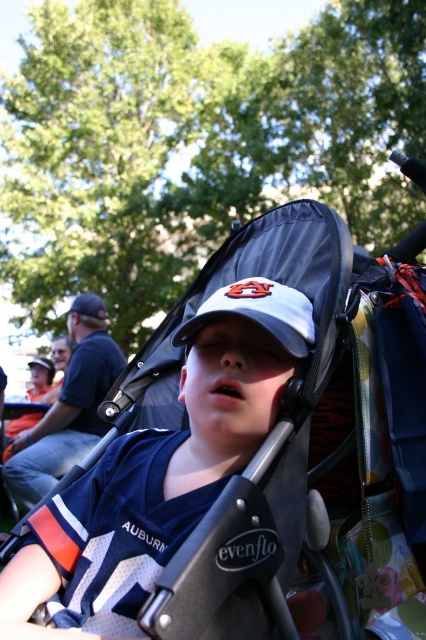
You are a photographer taking a picture of the stroller and its contents. You notice a point at coordinates (158,472). What object is located at this point?

The point at coordinates (158,472) indicates the white matte baseball cap at center.

You are a photographer positioned at a certain distance from the stroller. You want to take a closeup shot of the white matte baseball cap at center without moving the stroller. Given that your camera requires a minimum distance of 70 centimeters to focus properly, can you achieve a clear photo?

The distance between the white matte baseball cap at center and the camera is 78.65 centimeters, which is greater than the minimum required 70 centimeters. Therefore, the camera can focus properly and capture a clear photo.

You are a parent trying to place a pacifier between the white matte baseball cap at center and the gray matte baseball cap at center in the stroller. The pacifier is 3 inches long. Can it fit between them without overlapping either cap?

The white matte baseball cap at center and gray matte baseball cap at center are 5.71 inches apart. Since the pacifier is only 3 inches long, it can fit between them without overlapping either cap as there is enough space.